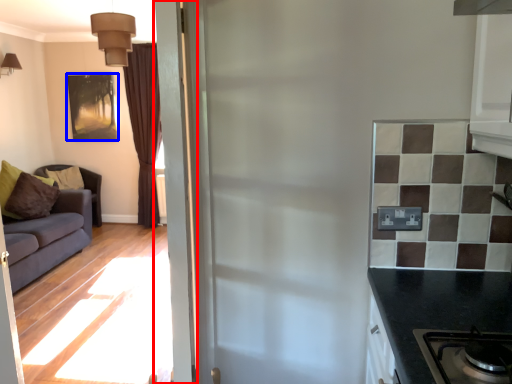
Question: Which object is closer to the camera taking this photo, door (highlighted by a red box) or picture frame (highlighted by a blue box)?

Choices:
 (A) door
 (B) picture frame

Answer: (A)